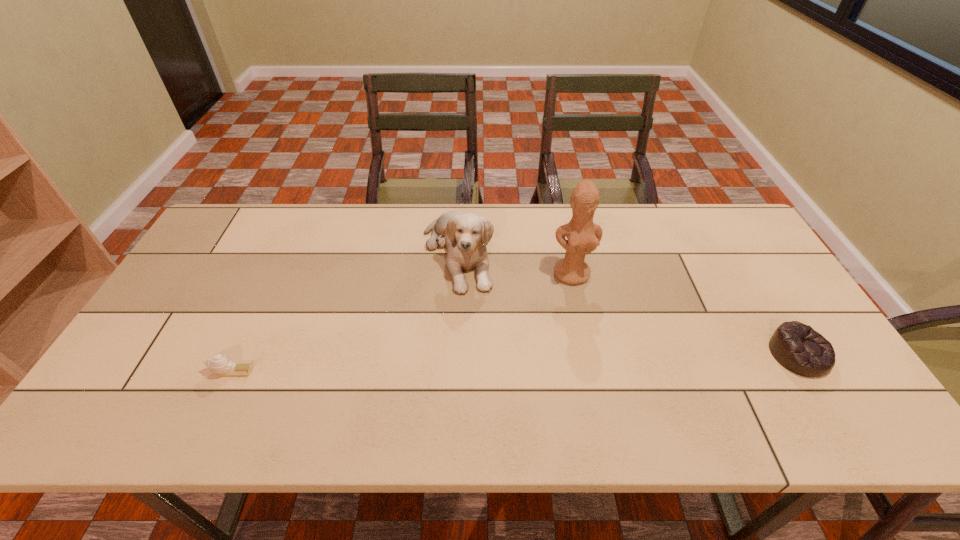
The width and height of the screenshot is (960, 540). I want to click on beanbag situated at the near edge, so click(797, 347).

Locate an element on the screen. The width and height of the screenshot is (960, 540). object positioned at the right edge is located at coordinates (797, 347).

Identify the location of object that is at the near right corner. (797, 347).

This screenshot has width=960, height=540. I want to click on free space at the far edge, so click(x=608, y=241).

You are a GUI agent. You are given a task and a screenshot of the screen. Output one action in this format:
    pyautogui.click(x=<x>, y=<y>)
    Task: Click on the vacant space at the near edge
    This screenshot has width=960, height=540.
    Given the screenshot: What is the action you would take?
    pyautogui.click(x=711, y=384)

The height and width of the screenshot is (540, 960). I want to click on vacant area at the left edge, so click(x=182, y=297).

You are a GUI agent. You are given a task and a screenshot of the screen. Output one action in this format:
    pyautogui.click(x=<x>, y=<y>)
    Task: Click on the free location at the right edge of the desktop
    The width and height of the screenshot is (960, 540).
    Given the screenshot: What is the action you would take?
    pyautogui.click(x=735, y=298)

Where is `vacant point at the far left corner`? The height and width of the screenshot is (540, 960). vacant point at the far left corner is located at coordinates (x=243, y=212).

The height and width of the screenshot is (540, 960). In the image, there is a desktop. Identify the location of vacant space at the near right corner. click(818, 381).

Image resolution: width=960 pixels, height=540 pixels. Identify the location of empty space between the tallest object and the rightmost object. (685, 314).